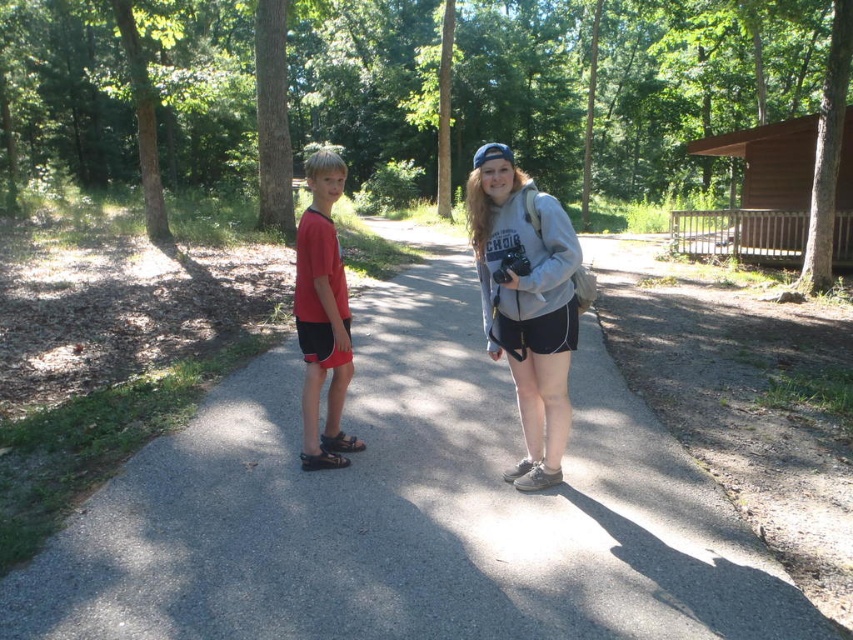
Is gray fleece hoodie at center further to the viewer compared to matte red t-shirt at center?

No.

Who is taller, gray fleece hoodie at center or matte red t-shirt at center?

Standing taller between the two is gray fleece hoodie at center.

The height and width of the screenshot is (640, 853). Find the location of `gray fleece hoodie at center`. gray fleece hoodie at center is located at coordinates (526, 301).

Does point (334, 563) come in front of point (561, 262)?

That is True.

Where is `gray asphalt trail at center`? The image size is (853, 640). gray asphalt trail at center is located at coordinates (409, 509).

Is gray asphalt trail at center bigger than matte red t-shirt at center?

No, gray asphalt trail at center is not bigger than matte red t-shirt at center.

This screenshot has height=640, width=853. What are the coordinates of `gray asphalt trail at center` in the screenshot? It's located at (409, 509).